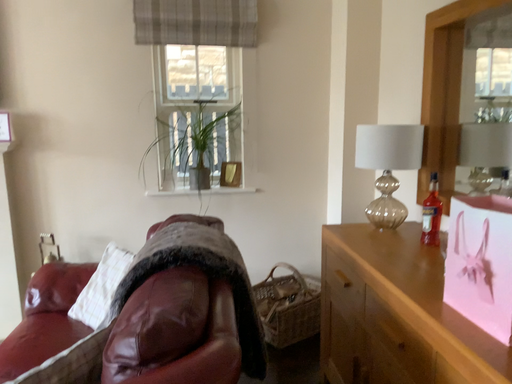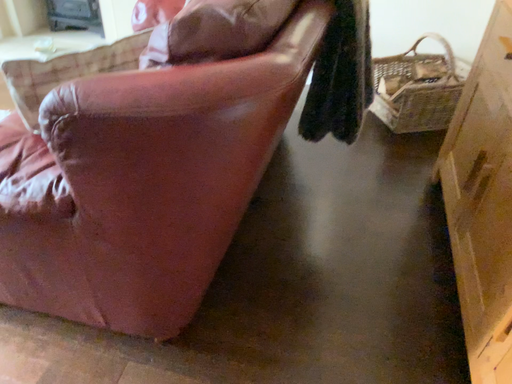
Question: Which way did the camera rotate in the video?

Choices:
 (A) rotated downward
 (B) rotated upward

Answer: (A)